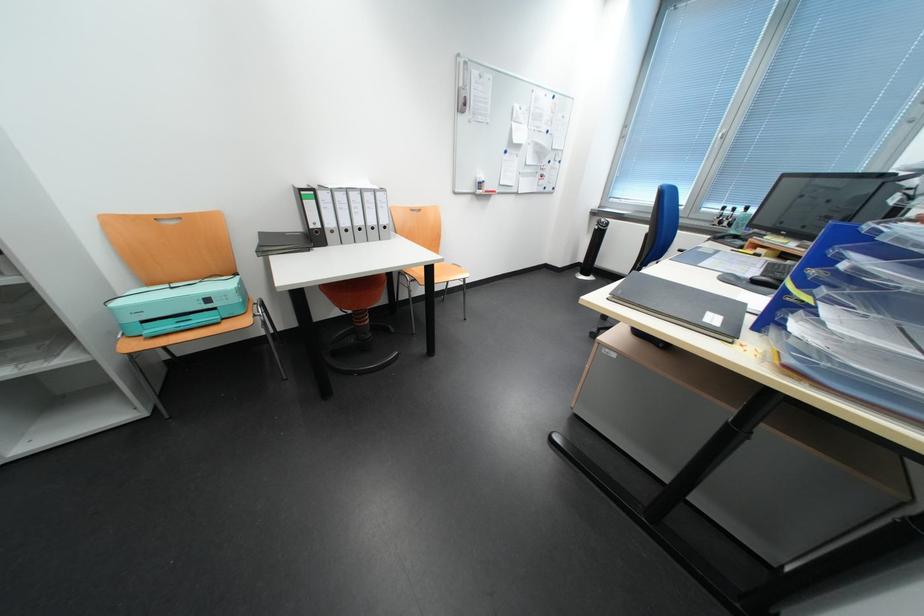
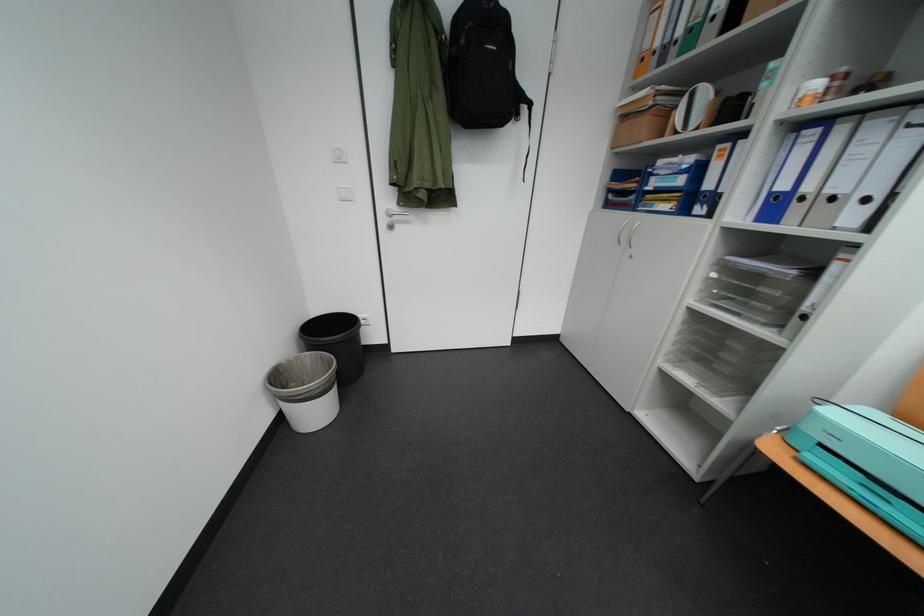
In the second image, find the point that corresponds to the point at 74,362 in the first image.

(730, 403)